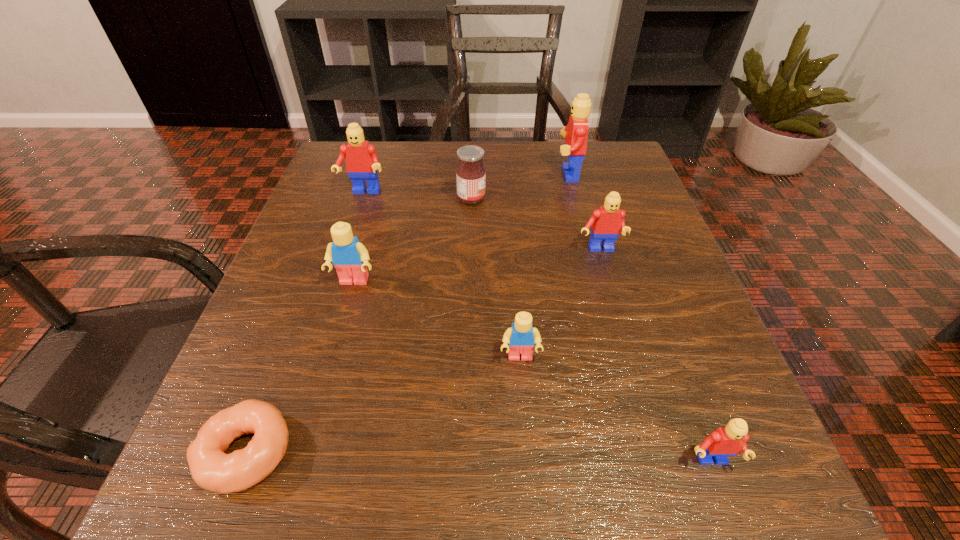
The image size is (960, 540). Find the location of `the right yellow Lego`. the right yellow Lego is located at coordinates (521, 336).

The image size is (960, 540). I want to click on the nearest Lego, so click(730, 440).

What are the coordinates of `the smallest red Lego` in the screenshot? It's located at (730, 440).

Where is `the shortest object`? the shortest object is located at coordinates (211, 468).

Where is `tan doughnut`? The width and height of the screenshot is (960, 540). tan doughnut is located at coordinates (211, 468).

At what (x,y) coordinates should I click in order to perform the action: click on vacant space situated on the front-facing side of the biggest red Lego. Please return your answer as a coordinate pair (x, y). The width and height of the screenshot is (960, 540). Looking at the image, I should click on (417, 172).

Locate an element on the screen. The height and width of the screenshot is (540, 960). vacant region located on the front-facing side of the biggest red Lego is located at coordinates (443, 172).

Where is `free point located 0.190m on the front-facing side of the biggest red Lego`? The width and height of the screenshot is (960, 540). free point located 0.190m on the front-facing side of the biggest red Lego is located at coordinates (469, 172).

Locate an element on the screen. This screenshot has width=960, height=540. free location located 0.080m on the front-facing side of the second tallest Lego is located at coordinates (353, 223).

The height and width of the screenshot is (540, 960). What are the coordinates of `free location located on the front-facing side of the bigger yellow Lego` in the screenshot? It's located at (338, 339).